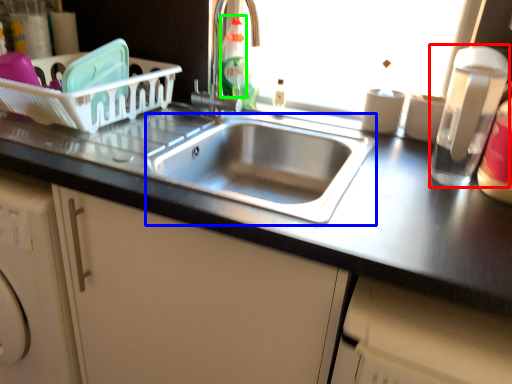
Question: Estimate the real-world distances between objects in this image. Which object is farther from appliance (highlighted by a red box), sink (highlighted by a blue box) or bottle (highlighted by a green box)?

Choices:
 (A) sink
 (B) bottle

Answer: (B)